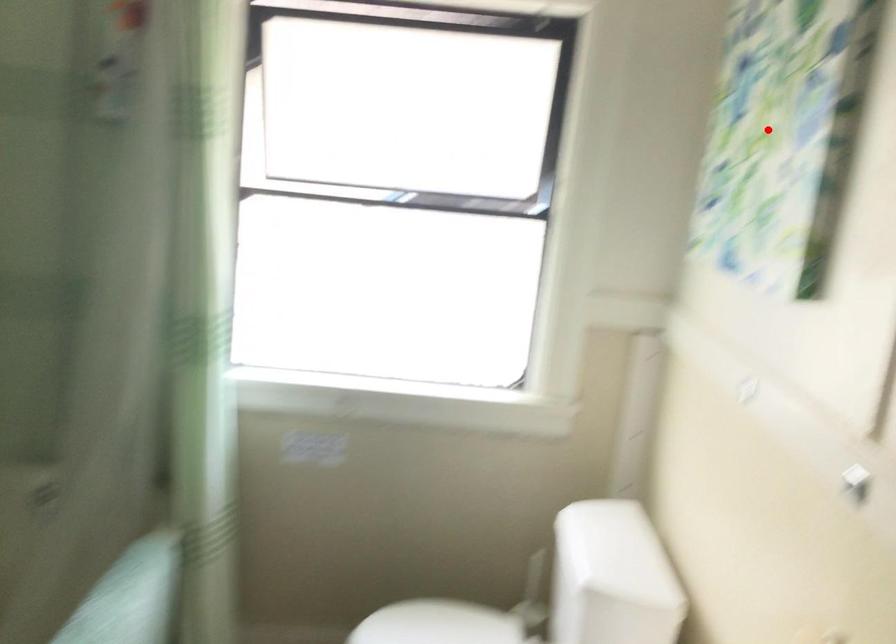
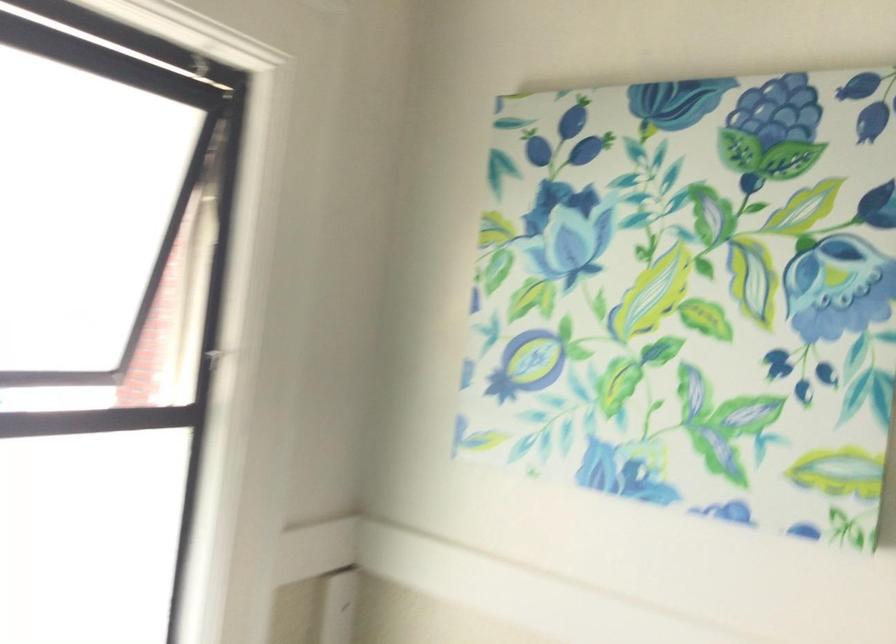
In the second image, find the point that corresponds to the highlighted location in the first image.

(693, 292)